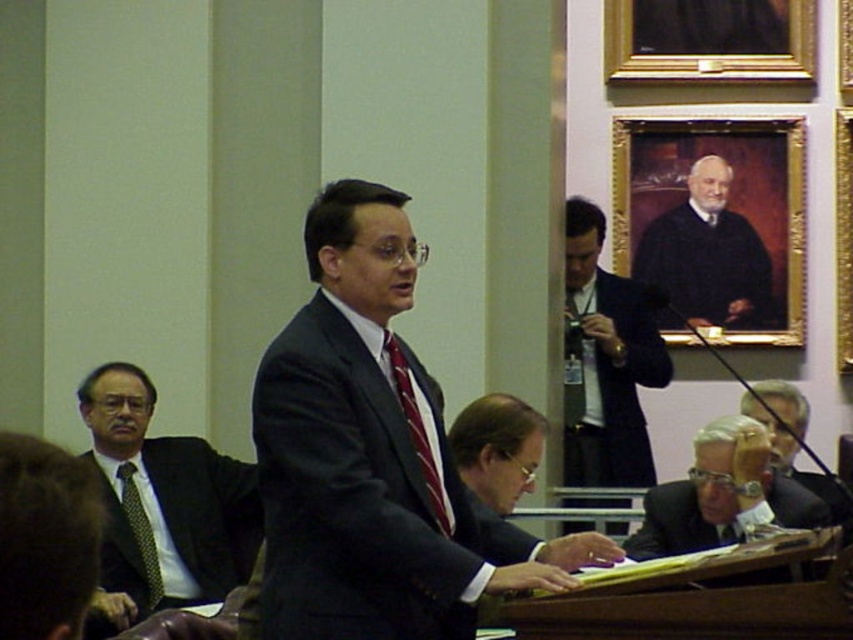
Question: Which is nearer to the dark gray suit at center?

Choices:
 (A) matte black suit at center
 (B) black matte suit at lower right
 (C) green dotted tie at left
 (D) dark blue suit at center

Answer: (A)

Question: Among these points, which one is farthest from the camera?

Choices:
 (A) (833, 499)
 (B) (440, 486)

Answer: (A)

Question: Observing the image, what is the correct spatial positioning of dark blue robe at upper center in reference to green dotted tie at left?

Choices:
 (A) right
 (B) left

Answer: (A)

Question: Which of the following is the closest to the observer?

Choices:
 (A) (718, 272)
 (B) (793, 474)

Answer: (B)

Question: Does dark gray suit at center have a larger size compared to dark blue robe at upper center?

Choices:
 (A) yes
 (B) no

Answer: (A)

Question: Can you confirm if matte black suit at left is positioned to the left of green dotted tie at left?

Choices:
 (A) yes
 (B) no

Answer: (A)